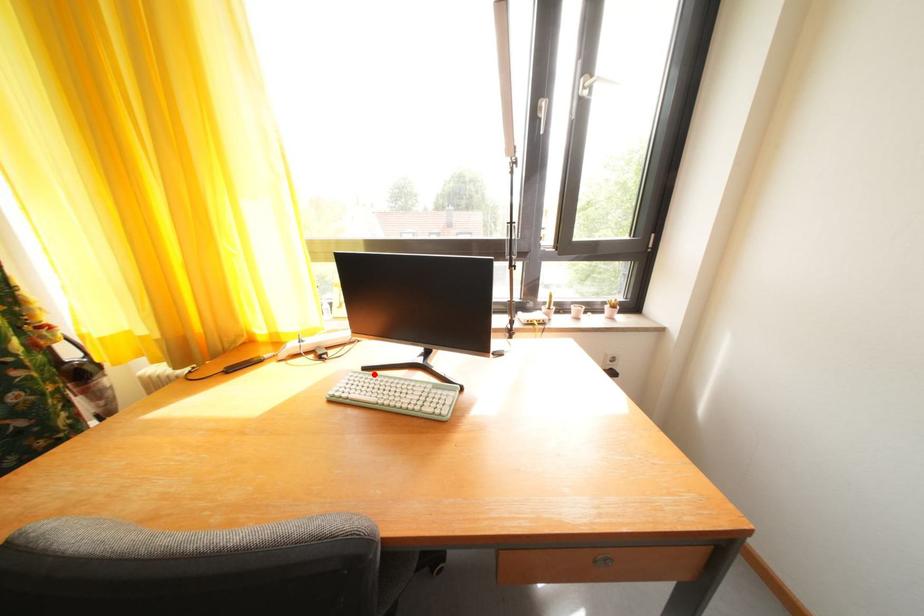
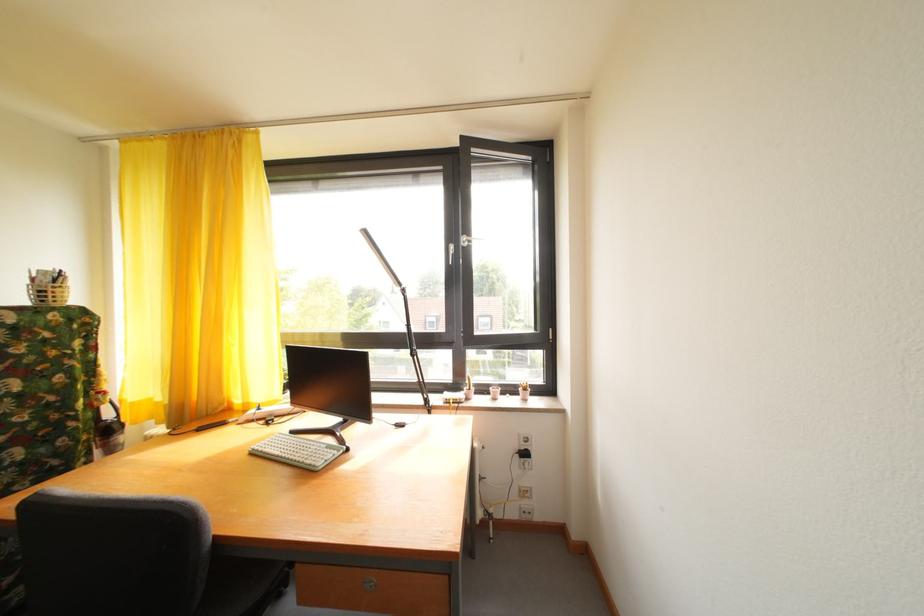
Locate, in the second image, the point that corresponds to the highlighted location in the first image.

(301, 438)